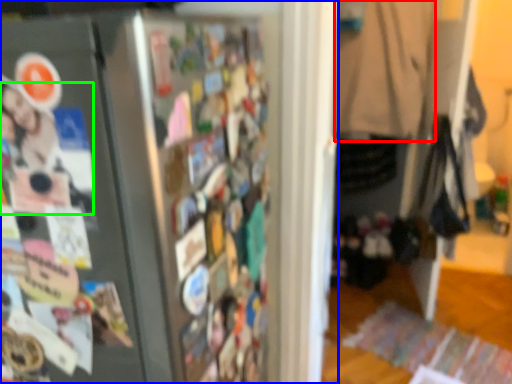
Question: Considering the real-world distances, which object is closest to clothing (highlighted by a red box)? refrigerator (highlighted by a blue box) or person (highlighted by a green box).

Choices:
 (A) refrigerator
 (B) person

Answer: (A)